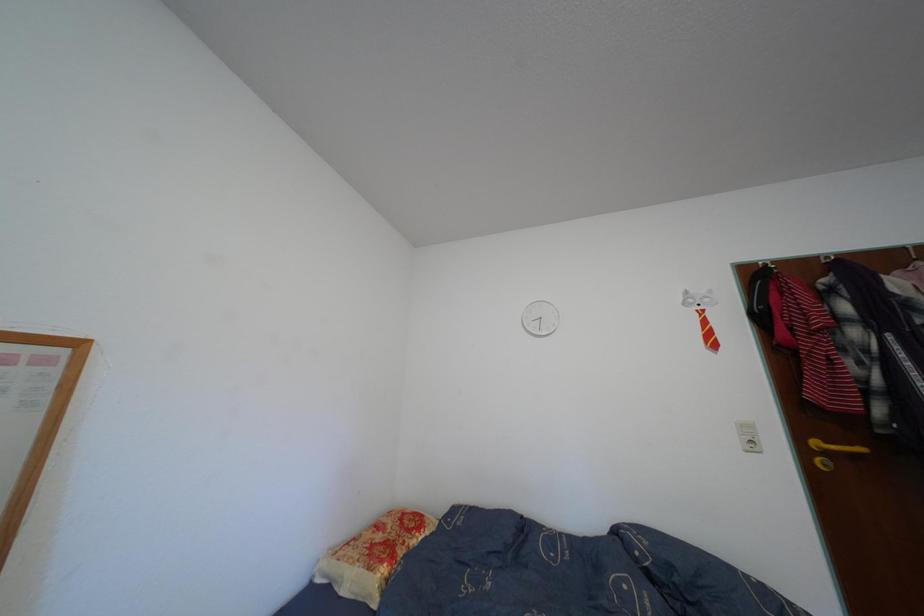
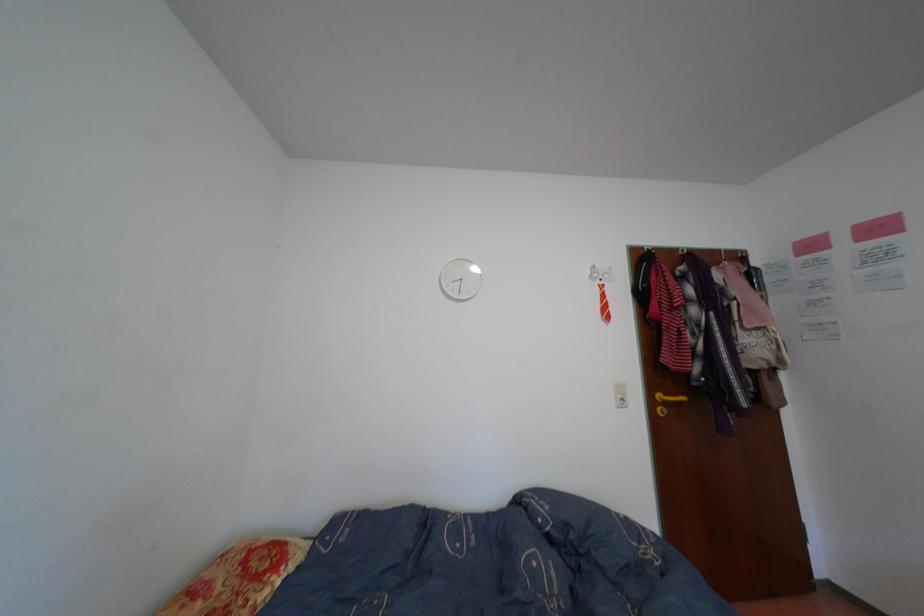
Question: What movement of the cameraman would produce the second image?

Choices:
 (A) Left
 (B) Right
 (C) Forward
 (D) Backward

Answer: (C)